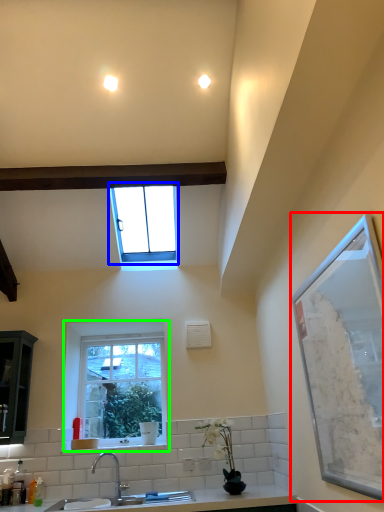
Question: Which is nearer to the window screen (highlighted by a red box)? window (highlighted by a blue box) or window (highlighted by a green box).

Choices:
 (A) window
 (B) window

Answer: (B)